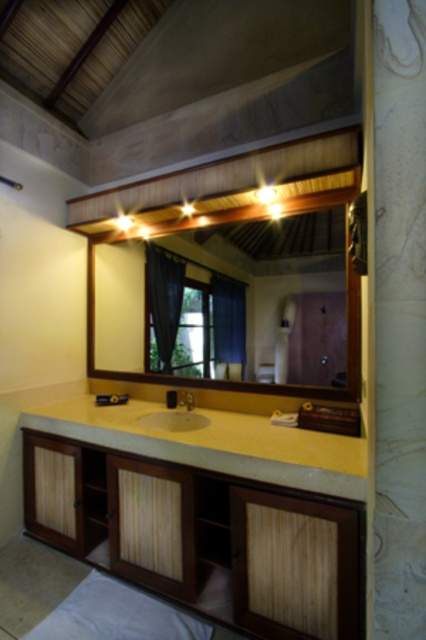
You are standing in the bathroom and want to place a new decorative item on the wooden cabinet at lower center. Based on its position, where exactly should you look to find it?

The wooden cabinet at lower center is located at point (207,513), so you should look towards that coordinate to find it.

You are standing in front of the bathroom vanity and want to adjust the curtains. Which curtain, the black fabric curtain at center or the dark blue fabric curtain at center, is closer to you?

The black fabric curtain at center is closer to you since the dark blue fabric curtain at center is behind it.